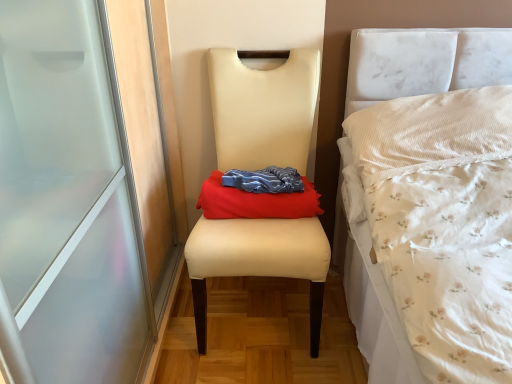
Question: Considering the relative sizes of matte cream chair at center and red fabric cloth at center in the image provided, is matte cream chair at center taller than red fabric cloth at center?

Choices:
 (A) no
 (B) yes

Answer: (B)

Question: Is matte cream chair at center shorter than red fabric cloth at center?

Choices:
 (A) no
 (B) yes

Answer: (A)

Question: Is matte cream chair at center bigger than red fabric cloth at center?

Choices:
 (A) yes
 (B) no

Answer: (A)

Question: Considering the relative sizes of matte cream chair at center and red fabric cloth at center in the image provided, is matte cream chair at center wider than red fabric cloth at center?

Choices:
 (A) no
 (B) yes

Answer: (B)

Question: Could red fabric cloth at center be considered to be inside matte cream chair at center?

Choices:
 (A) yes
 (B) no

Answer: (A)

Question: Considering the relative sizes of matte cream chair at center and red fabric cloth at center in the image provided, is matte cream chair at center smaller than red fabric cloth at center?

Choices:
 (A) no
 (B) yes

Answer: (A)

Question: Is red fabric cloth at center looking in the opposite direction of matte cream chair at center?

Choices:
 (A) yes
 (B) no

Answer: (A)

Question: From the image's perspective, would you say red fabric cloth at center is shown under matte cream chair at center?

Choices:
 (A) yes
 (B) no

Answer: (B)

Question: Could you tell me if red fabric cloth at center is turned towards matte cream chair at center?

Choices:
 (A) no
 (B) yes

Answer: (B)

Question: Does red fabric cloth at center have a larger size compared to matte cream chair at center?

Choices:
 (A) no
 (B) yes

Answer: (A)

Question: From a real-world perspective, is red fabric cloth at center over matte cream chair at center?

Choices:
 (A) no
 (B) yes

Answer: (B)

Question: Considering the relative positions of red fabric cloth at center and matte cream chair at center in the image provided, is red fabric cloth at center to the left of matte cream chair at center from the viewer's perspective?

Choices:
 (A) yes
 (B) no

Answer: (B)

Question: From a real-world perspective, is matte cream chair at center positioned above or below red fabric cloth at center?

Choices:
 (A) below
 (B) above

Answer: (A)